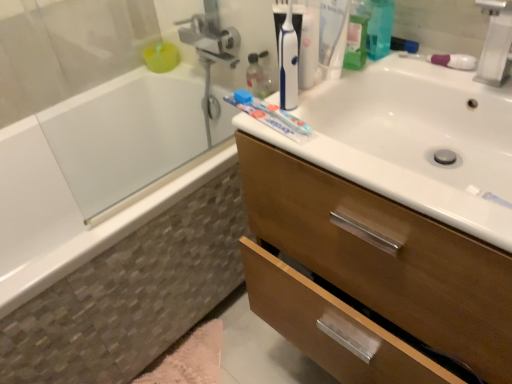
Describe the element at coordinates (496, 43) in the screenshot. I see `white plastic faucet at upper right` at that location.

The width and height of the screenshot is (512, 384). I want to click on brown wood cabinet at upper center, so click(x=386, y=257).

The width and height of the screenshot is (512, 384). Identify the location of white plastic faucet at upper right. (496, 43).

How much distance is there between white glossy sink at upper right and white frosted glass bathtub at left, which is the 2th bath in bottom-to-top order?

white glossy sink at upper right and white frosted glass bathtub at left, which is the 2th bath in bottom-to-top order, are 32.53 inches apart from each other.

Could you tell me if white glossy sink at upper right is turned towards white frosted glass bathtub at left, which is the 2th bath in bottom-to-top order?

No, white glossy sink at upper right is not facing towards white frosted glass bathtub at left, which is the 2th bath in bottom-to-top order.

Is white glossy sink at upper right to the left of white frosted glass bathtub at left, which is the 2th bath in bottom-to-top order, from the viewer's perspective?

In fact, white glossy sink at upper right is to the right of white frosted glass bathtub at left, which is the 2th bath in bottom-to-top order.

Is white glossy sink at upper right located outside white frosted glass bathtub at left, which is the 2th bath in bottom-to-top order?

That's correct, white glossy sink at upper right is outside of white frosted glass bathtub at left, which is the 2th bath in bottom-to-top order.

Is white plastic faucet at upper right to the right of white glossy bathtub at left, acting as the second bath starting from the top, from the viewer's perspective?

Yes, white plastic faucet at upper right is to the right of white glossy bathtub at left, acting as the second bath starting from the top.

From the image's perspective, is white plastic faucet at upper right under white glossy bathtub at left, acting as the second bath starting from the top?

Actually, white plastic faucet at upper right appears above white glossy bathtub at left, acting as the second bath starting from the top, in the image.

Between white plastic faucet at upper right and white glossy bathtub at left, which ranks as the 1th bath in bottom-to-top order, which one has larger size?

With larger size is white glossy bathtub at left, which ranks as the 1th bath in bottom-to-top order.

From their relative heights in the image, would you say white plastic faucet at upper right is taller or shorter than white glossy bathtub at left, which ranks as the 1th bath in bottom-to-top order?

In the image, white plastic faucet at upper right appears to be shorter than white glossy bathtub at left, which ranks as the 1th bath in bottom-to-top order.

Is white plastic faucet at upper right oriented away from pink fluffy bath mat at lower left?

No.

Would you say white plastic faucet at upper right is to the left or to the right of pink fluffy bath mat at lower left in the picture?

white plastic faucet at upper right is positioned on pink fluffy bath mat at lower left's right side.

From the picture: Is white plastic faucet at upper right bigger than pink fluffy bath mat at lower left?

Actually, white plastic faucet at upper right might be smaller than pink fluffy bath mat at lower left.

From a real-world perspective, is white plastic faucet at upper right over pink fluffy bath mat at lower left?

Indeed, from a real-world perspective, white plastic faucet at upper right stands above pink fluffy bath mat at lower left.

Is white frosted glass bathtub at left, positioned as the 1th bath in top-to-bottom order, located outside white plastic faucet at upper right?

Indeed, white frosted glass bathtub at left, positioned as the 1th bath in top-to-bottom order, is completely outside white plastic faucet at upper right.

From the picture: Is white frosted glass bathtub at left, which is the 2th bath in bottom-to-top order, not near white plastic faucet at upper right?

Yes.

What's the angular difference between white frosted glass bathtub at left, positioned as the 1th bath in top-to-bottom order, and white plastic faucet at upper right's facing directions?

They differ by 0.703 degrees in their facing directions.

Is point (153, 99) more distant than point (498, 16)?

Yes, it is behind point (498, 16).

Where is `bathroom cabinet beneath the white plastic faucet at upper right (from a real-world perspective)`? This screenshot has width=512, height=384. bathroom cabinet beneath the white plastic faucet at upper right (from a real-world perspective) is located at coordinates click(x=386, y=257).

What's the angular difference between brown wood cabinet at upper center and white plastic faucet at upper right's facing directions?

They differ by 0.869 degrees in their facing directions.

Is brown wood cabinet at upper center not near white plastic faucet at upper right?

No, brown wood cabinet at upper center is not far from white plastic faucet at upper right.

Is point (489, 378) behind point (511, 60)?

No, (489, 378) is closer to viewer.

Considering the sizes of objects white frosted glass bathtub at left, which is the 2th bath in bottom-to-top order, and brown wood cabinet at upper center in the image provided, who is taller, white frosted glass bathtub at left, which is the 2th bath in bottom-to-top order, or brown wood cabinet at upper center?

brown wood cabinet at upper center is taller.

Does point (60, 114) appear closer or farther from the camera than point (380, 305)?

Point (60, 114) is positioned farther from the camera compared to point (380, 305).

Visually, is white frosted glass bathtub at left, positioned as the 1th bath in top-to-bottom order, positioned to the left or to the right of brown wood cabinet at upper center?

In the image, white frosted glass bathtub at left, positioned as the 1th bath in top-to-bottom order, appears on the left side of brown wood cabinet at upper center.

From a real-world perspective, which is physically above, white frosted glass bathtub at left, positioned as the 1th bath in top-to-bottom order, or brown wood cabinet at upper center?

white frosted glass bathtub at left, positioned as the 1th bath in top-to-bottom order, is physically above.

Is there a large distance between white frosted glass bathtub at left, which is the 2th bath in bottom-to-top order, and white glossy sink at upper right?

white frosted glass bathtub at left, which is the 2th bath in bottom-to-top order, is actually quite close to white glossy sink at upper right.

In terms of width, does white frosted glass bathtub at left, which is the 2th bath in bottom-to-top order, look wider or thinner when compared to white glossy sink at upper right?

white frosted glass bathtub at left, which is the 2th bath in bottom-to-top order, is thinner than white glossy sink at upper right.

Between white frosted glass bathtub at left, which is the 2th bath in bottom-to-top order, and white glossy sink at upper right, which one is positioned in front?

white glossy sink at upper right.

Is white frosted glass bathtub at left, which is the 2th bath in bottom-to-top order, at the right side of white glossy sink at upper right?

In fact, white frosted glass bathtub at left, which is the 2th bath in bottom-to-top order, is to the left of white glossy sink at upper right.

I want to click on sink that appears on the right of white frosted glass bathtub at left, which is the 2th bath in bottom-to-top order, so click(x=413, y=140).

Find the location of a particular element. This screenshot has height=384, width=512. the 1st bath behind the white plastic faucet at upper right is located at coordinates (112, 230).

Looking at the image, which one is located further to brown wood cabinet at upper center, white frosted glass bathtub at left, positioned as the 1th bath in top-to-bottom order, or white glossy sink at upper right?

white frosted glass bathtub at left, positioned as the 1th bath in top-to-bottom order, is further to brown wood cabinet at upper center.

Which object lies further to the anchor point white frosted glass bathtub at left, which is the 2th bath in bottom-to-top order, white plastic faucet at upper right or white glossy bathtub at left, which ranks as the 1th bath in bottom-to-top order?

The object further to white frosted glass bathtub at left, which is the 2th bath in bottom-to-top order, is white plastic faucet at upper right.

Considering their positions, is brown wood cabinet at upper center positioned closer to white glossy sink at upper right than white plastic faucet at upper right?

brown wood cabinet at upper center lies closer to white glossy sink at upper right than the other object.

From the image, which object appears to be nearer to white glossy bathtub at left, acting as the second bath starting from the top, white plastic faucet at upper right or white frosted glass bathtub at left, positioned as the 1th bath in top-to-bottom order?

The object closer to white glossy bathtub at left, acting as the second bath starting from the top, is white frosted glass bathtub at left, positioned as the 1th bath in top-to-bottom order.

Looking at the image, which one is located closer to white plastic faucet at upper right, pink fluffy bath mat at lower left or brown wood cabinet at upper center?

brown wood cabinet at upper center is positioned closer to the anchor white plastic faucet at upper right.

Looking at the image, which one is located further to brown wood cabinet at upper center, white glossy bathtub at left, acting as the second bath starting from the top, or white plastic faucet at upper right?

The object further to brown wood cabinet at upper center is white glossy bathtub at left, acting as the second bath starting from the top.

Looking at the image, which one is located further to white plastic faucet at upper right, white glossy bathtub at left, which ranks as the 1th bath in bottom-to-top order, or brown wood cabinet at upper center?

white glossy bathtub at left, which ranks as the 1th bath in bottom-to-top order, lies further to white plastic faucet at upper right than the other object.

Estimate the real-world distances between objects in this image. Which object is further from brown wood cabinet at upper center, white frosted glass bathtub at left, positioned as the 1th bath in top-to-bottom order, or white glossy bathtub at left, which ranks as the 1th bath in bottom-to-top order?

white frosted glass bathtub at left, positioned as the 1th bath in top-to-bottom order, is positioned further to the anchor brown wood cabinet at upper center.

The height and width of the screenshot is (384, 512). In order to click on bathroom cabinet between white glossy bathtub at left, acting as the second bath starting from the top, and white plastic faucet at upper right in this screenshot , I will do `click(386, 257)`.

Locate an element on the screen. The image size is (512, 384). sink between white plastic faucet at upper right and pink fluffy bath mat at lower left from top to bottom is located at coordinates (413, 140).

Find the location of a particular element. sink positioned between brown wood cabinet at upper center and pink fluffy bath mat at lower left from near to far is located at coordinates pyautogui.click(x=413, y=140).

Locate an element on the screen. The image size is (512, 384). bathroom cabinet between white frosted glass bathtub at left, which is the 2th bath in bottom-to-top order, and white plastic faucet at upper right from left to right is located at coordinates (386, 257).